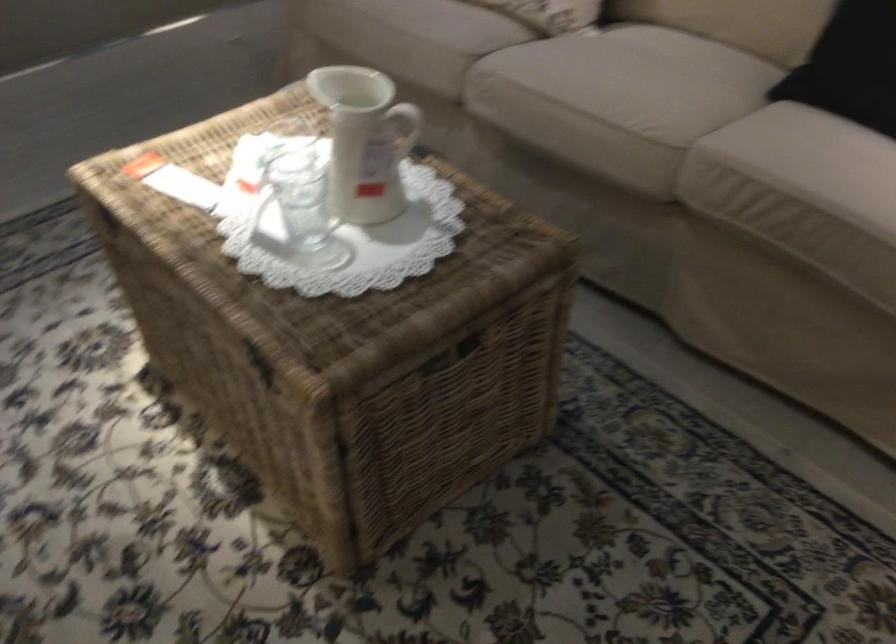
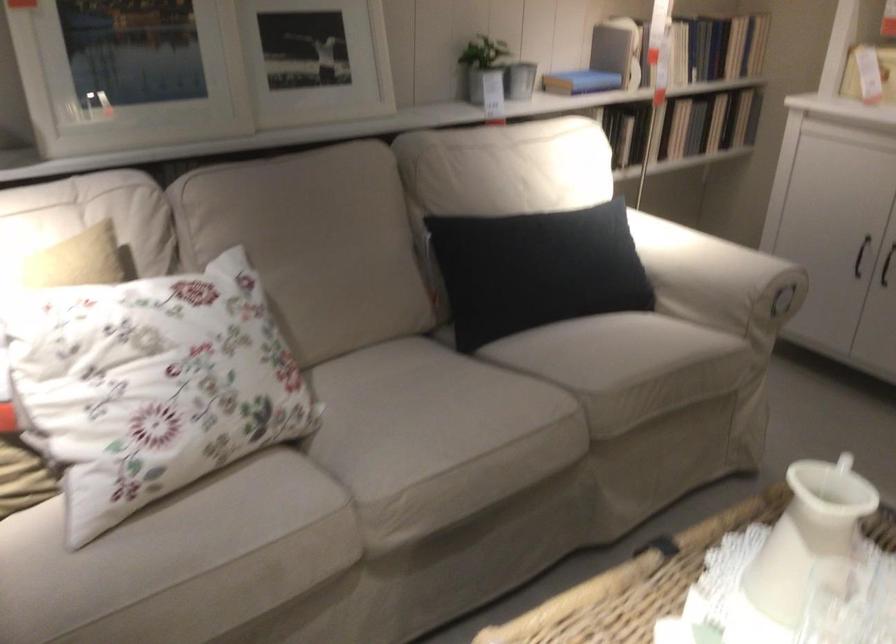
In the second image, find the point that corresponds to (511,80) in the first image.

(398, 494)